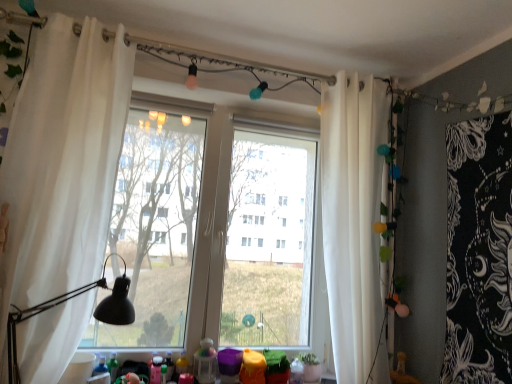
Question: From a real-world perspective, is white sheer curtain at left, which is counted as the second curtain, starting from the back, positioned over white sheer curtain at right, marked as the 1th curtain in a back-to-front arrangement, based on gravity?

Choices:
 (A) no
 (B) yes

Answer: (B)

Question: From the image's perspective, is white sheer curtain at left, marked as the 2th curtain in a right-to-left arrangement, over white sheer curtain at right, which ranks as the second curtain in front-to-back order?

Choices:
 (A) no
 (B) yes

Answer: (B)

Question: Is the depth of white sheer curtain at left, marked as the 2th curtain in a right-to-left arrangement, greater than that of white sheer curtain at right, which ranks as the second curtain in front-to-back order?

Choices:
 (A) no
 (B) yes

Answer: (A)

Question: Is white sheer curtain at left, marked as the 2th curtain in a right-to-left arrangement, facing away from white sheer curtain at right, the first curtain positioned from the right?

Choices:
 (A) yes
 (B) no

Answer: (B)

Question: From a real-world perspective, is white sheer curtain at left, the first curtain positioned from the front, under white sheer curtain at right, the first curtain positioned from the right?

Choices:
 (A) yes
 (B) no

Answer: (B)

Question: Is translucent plastic toy at lower center situated inside white sheer curtain at right, marked as the second curtain in a left-to-right arrangement, or outside?

Choices:
 (A) inside
 (B) outside

Answer: (B)

Question: Considering the positions of translucent plastic toy at lower center and white sheer curtain at right, which ranks as the second curtain in front-to-back order, in the image, is translucent plastic toy at lower center bigger or smaller than white sheer curtain at right, which ranks as the second curtain in front-to-back order,?

Choices:
 (A) big
 (B) small

Answer: (B)

Question: In the image, is translucent plastic toy at lower center positioned in front of or behind white sheer curtain at right, which ranks as the second curtain in front-to-back order?

Choices:
 (A) behind
 (B) front

Answer: (A)

Question: Is translucent plastic toy at lower center taller or shorter than white sheer curtain at right, marked as the second curtain in a left-to-right arrangement?

Choices:
 (A) tall
 (B) short

Answer: (B)

Question: Considering the positions of black matte table lamp at left and white sheer curtain at left, the 1th curtain from the left, in the image, is black matte table lamp at left bigger or smaller than white sheer curtain at left, the 1th curtain from the left,?

Choices:
 (A) big
 (B) small

Answer: (B)

Question: Is black matte table lamp at left situated inside white sheer curtain at left, the first curtain positioned from the front, or outside?

Choices:
 (A) inside
 (B) outside

Answer: (A)

Question: From the image's perspective, is black matte table lamp at left located above or below white sheer curtain at left, which is counted as the second curtain, starting from the back?

Choices:
 (A) below
 (B) above

Answer: (A)

Question: Relative to white sheer curtain at left, which is counted as the second curtain, starting from the back, is black matte table lamp at left in front or behind?

Choices:
 (A) behind
 (B) front

Answer: (B)

Question: Based on their sizes in the image, would you say transparent glass window at center is bigger or smaller than white sheer curtain at right, which ranks as the second curtain in front-to-back order?

Choices:
 (A) small
 (B) big

Answer: (B)

Question: Considering the positions of point (204, 210) and point (339, 372), is point (204, 210) closer or farther from the camera than point (339, 372)?

Choices:
 (A) farther
 (B) closer

Answer: (A)